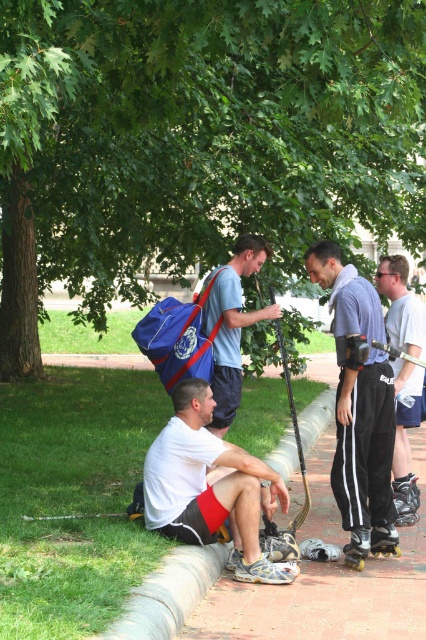
Measure the distance between matte gray pants at right and camera.

matte gray pants at right is 7.08 meters from camera.

Which is more to the left, matte gray pants at right or black matte roller skate at lower right?

black matte roller skate at lower right is more to the left.

This screenshot has width=426, height=640. What are the coordinates of `matte gray pants at right` in the screenshot? It's located at (405, 438).

The height and width of the screenshot is (640, 426). I want to click on matte gray pants at right, so click(405, 438).

Locate an element on the screen. The image size is (426, 640). brick pavement at lower center is located at coordinates (330, 595).

Which of these two, brick pavement at lower center or yellow plastic roller skate at lower right, stands shorter?

Standing shorter between the two is brick pavement at lower center.

Image resolution: width=426 pixels, height=640 pixels. I want to click on brick pavement at lower center, so click(x=330, y=595).

Identify the location of brick pavement at lower center. This screenshot has height=640, width=426. (330, 595).

Can you confirm if white matte shorts at lower left is smaller than black matte roller skate at lower right?

Incorrect, white matte shorts at lower left is not smaller in size than black matte roller skate at lower right.

Is white matte shorts at lower left below black matte roller skate at lower right?

Actually, white matte shorts at lower left is above black matte roller skate at lower right.

Find the location of a particular element. This screenshot has width=426, height=640. white matte shorts at lower left is located at coordinates (207, 484).

Locate an element on the screen. The height and width of the screenshot is (640, 426). white matte shorts at lower left is located at coordinates (207, 484).